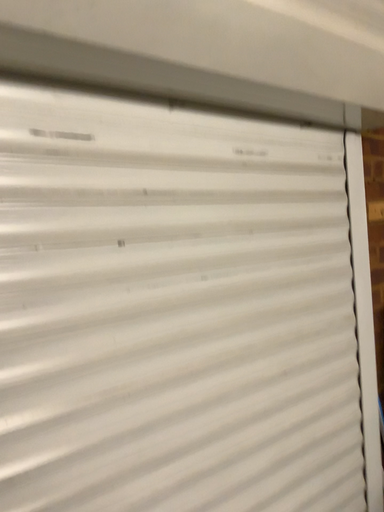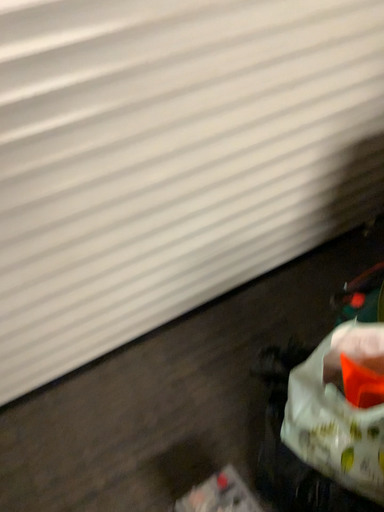
Question: How did the camera likely rotate when shooting the video?

Choices:
 (A) rotated upward
 (B) rotated downward

Answer: (B)